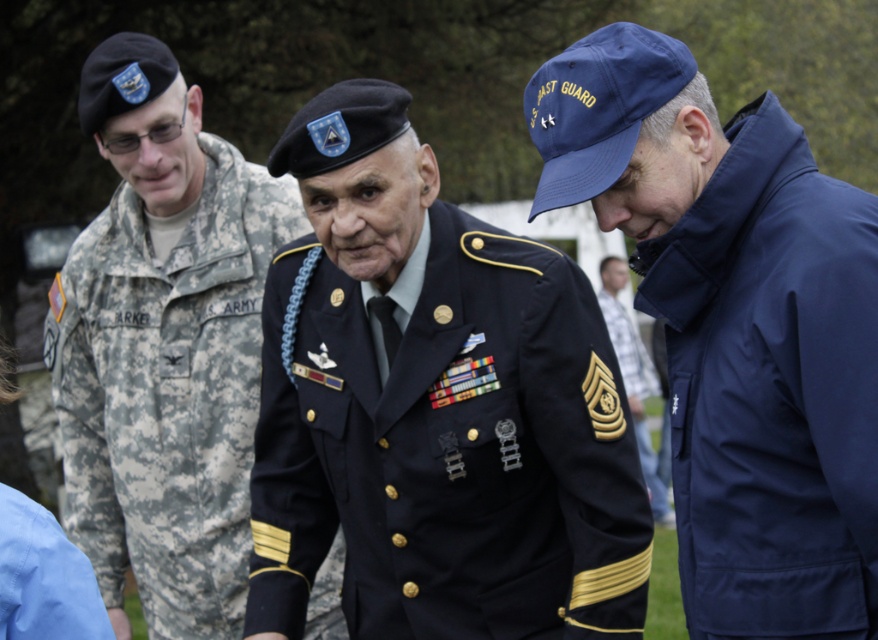
Looking at this image, measure the distance between point (747, 428) and camera.

Point (747, 428) is 3.15 meters away from camera.

Based on the photo, which is below, navy blue jacket at lower right or navy blue uniform at center?

navy blue uniform at center

Measure the distance between point [733,413] and camera.

They are 10.48 feet apart.

You are a GUI agent. You are given a task and a screenshot of the screen. Output one action in this format:
    pyautogui.click(x=<x>, y=<y>)
    Task: Click on the navy blue jacket at lower right
    This screenshot has height=640, width=878.
    Given the screenshot: What is the action you would take?
    tap(736, 326)

Between navy blue fabric uniform at center and navy blue uniform at center, which one appears on the right side from the viewer's perspective?

From the viewer's perspective, navy blue uniform at center appears more on the right side.

What do you see at coordinates (450, 451) in the screenshot? I see `navy blue fabric uniform at center` at bounding box center [450, 451].

Is point (416, 433) behind point (646, 488)?

No.

The width and height of the screenshot is (878, 640). I want to click on navy blue fabric uniform at center, so click(450, 451).

Does point (56, 572) lie behind point (601, 291)?

No, it is not.

Between blue fabric shirt at lower left and navy blue uniform at center, which one has more height?

navy blue uniform at center is taller.

Who is more forward, (36,506) or (623,349)?

Positioned in front is point (36,506).

At what (x,y) coordinates should I click in order to perform the action: click on blue fabric shirt at lower left. Please return your answer as a coordinate pair (x, y). Looking at the image, I should click on (42, 577).